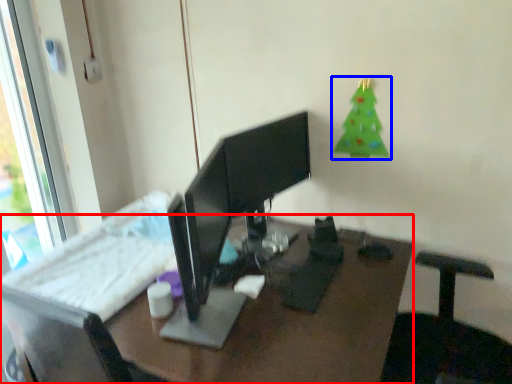
Question: Which object is closer to the camera taking this photo, desk (highlighted by a red box) or christmas tree (highlighted by a blue box)?

Choices:
 (A) desk
 (B) christmas tree

Answer: (A)